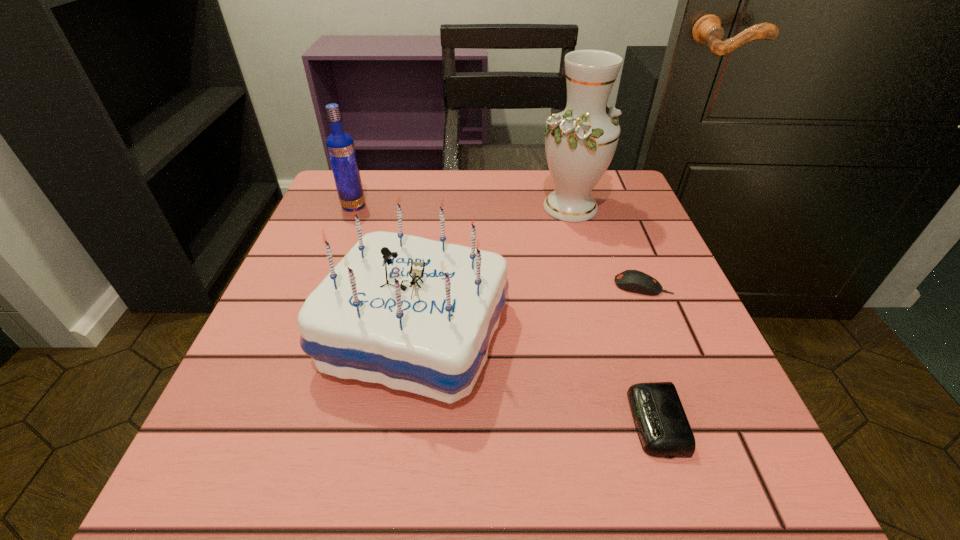
Locate an element on the screen. This screenshot has height=540, width=960. blank area in the image that satisfies the following two spatial constraints: 1. on the front side of the tallest object; 2. on the left side of the computer mouse is located at coordinates (592, 286).